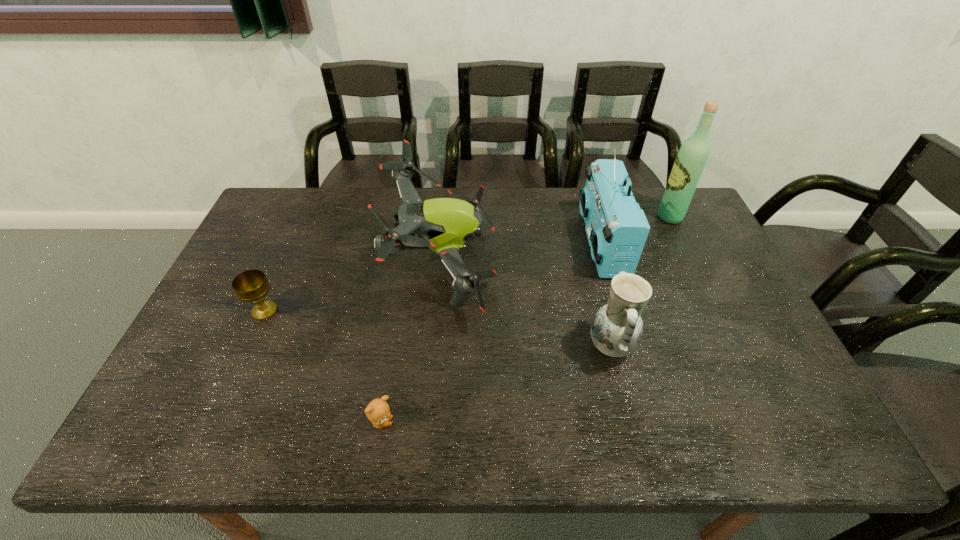
At what (x,y) coordinates should I click in order to perform the action: click on vacant space located on the front-facing side of the wine bottle. Please return your answer as a coordinate pair (x, y). The image size is (960, 540). Looking at the image, I should click on (607, 217).

Image resolution: width=960 pixels, height=540 pixels. What are the coordinates of `free space located on the front-facing side of the wine bottle` in the screenshot? It's located at (557, 217).

In order to click on free spot located 0.190m on the front-facing side of the drone in this screenshot , I will do `click(557, 263)`.

The image size is (960, 540). Identify the location of vacant position located on the front-facing side of the radio receiver. (509, 242).

The height and width of the screenshot is (540, 960). In order to click on free space located on the front-facing side of the radio receiver in this screenshot , I will do `click(496, 242)`.

The image size is (960, 540). Find the location of `vacant area situated on the front-facing side of the radio receiver`. vacant area situated on the front-facing side of the radio receiver is located at coordinates (537, 242).

You are a GUI agent. You are given a task and a screenshot of the screen. Output one action in this format:
    pyautogui.click(x=<x>, y=<y>)
    Task: Click on the vacant space situated on either side of the fourth tallest object
    This screenshot has width=960, height=540.
    Given the screenshot: What is the action you would take?
    pyautogui.click(x=548, y=346)

What are the coordinates of `vacant space located 0.150m on either side of the fourth tallest object` in the screenshot? It's located at (529, 346).

At what (x,y) coordinates should I click in order to perform the action: click on vacant space positioned 0.370m on either side of the fourth tallest object. Please return your answer as a coordinate pair (x, y). This screenshot has width=960, height=540. Looking at the image, I should click on (444, 346).

The height and width of the screenshot is (540, 960). I want to click on free space located 0.320m on the back of the leftmost object, so click(301, 227).